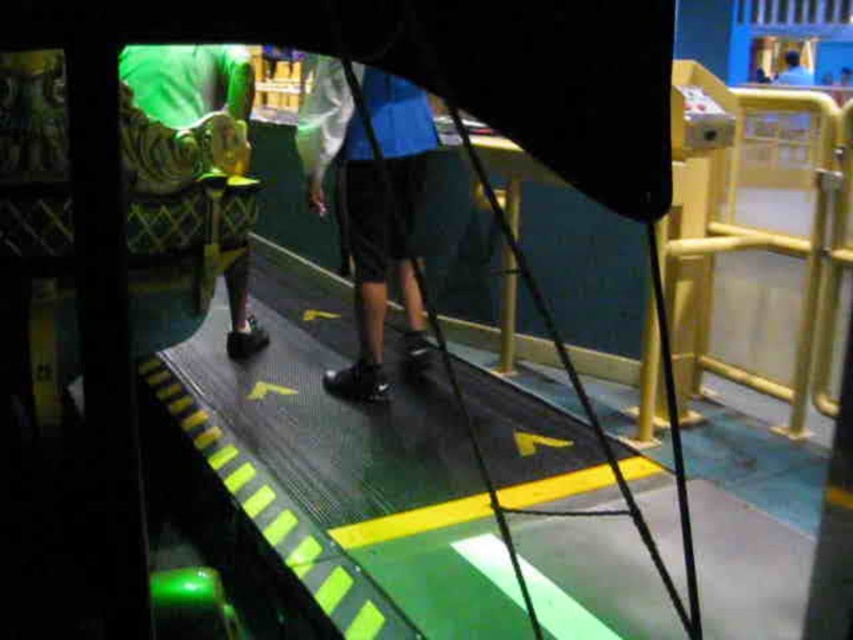
Who is more distant from viewer, [381,278] or [230,310]?

The point [230,310] is more distant.

Can you confirm if shiny black shoes at center is positioned to the left of green quilted fabric at left?

Incorrect, shiny black shoes at center is not on the left side of green quilted fabric at left.

At what (x,y) coordinates should I click in order to perform the action: click on shiny black shoes at center. Please return your answer as a coordinate pair (x, y). The image size is (853, 640). Looking at the image, I should click on (370, 198).

At what (x,y) coordinates should I click in order to perform the action: click on shiny black shoes at center. Please return your answer as a coordinate pair (x, y). This screenshot has width=853, height=640. Looking at the image, I should click on (370, 198).